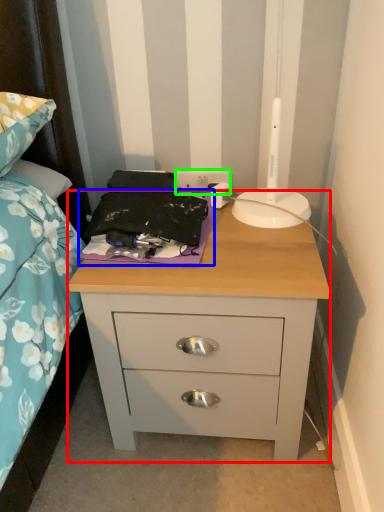
Question: Which object is positioned closest to nightstand (highlighted by a red box)? Select from sheet (highlighted by a blue box) and electric outlet (highlighted by a green box).

Choices:
 (A) sheet
 (B) electric outlet

Answer: (A)